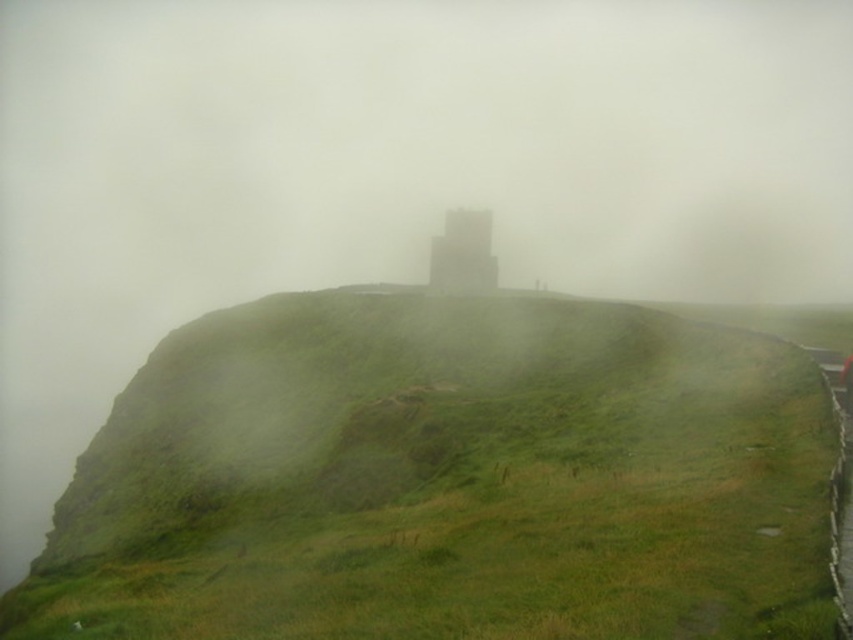
Is green grassy hillside at center positioned in front of gray concrete tower at center?

That is True.

Looking at this image, who is more forward, (535, 353) or (440, 236)?

Positioned in front is point (535, 353).

The image size is (853, 640). What do you see at coordinates (445, 480) in the screenshot?
I see `green grassy hillside at center` at bounding box center [445, 480].

Where is `green grassy hillside at center`? The width and height of the screenshot is (853, 640). green grassy hillside at center is located at coordinates [445, 480].